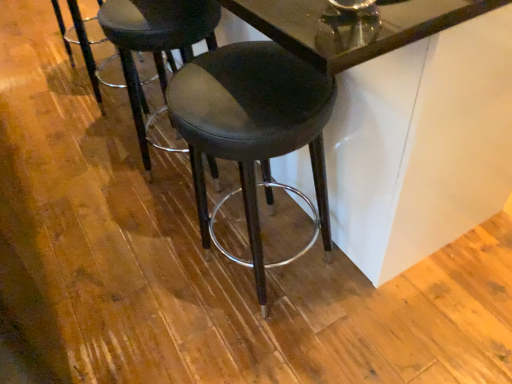
Question: Is glossy glass table at center closer to the viewer compared to black leather stool at center?

Choices:
 (A) no
 (B) yes

Answer: (B)

Question: Can you confirm if glossy glass table at center is bigger than black leather stool at center?

Choices:
 (A) yes
 (B) no

Answer: (A)

Question: Is glossy glass table at center smaller than black leather stool at center?

Choices:
 (A) yes
 (B) no

Answer: (B)

Question: From the image's perspective, does glossy glass table at center appear lower than black leather stool at center?

Choices:
 (A) yes
 (B) no

Answer: (B)

Question: Does glossy glass table at center have a greater height compared to black leather stool at center?

Choices:
 (A) no
 (B) yes

Answer: (B)

Question: From a real-world perspective, relative to glossy glass table at center, is matte black stool at center, which is counted as the 1th stool, starting from the left, vertically above or below?

Choices:
 (A) above
 (B) below

Answer: (B)

Question: From the image's perspective, is matte black stool at center, the second stool when ordered from right to left, above or below glossy glass table at center?

Choices:
 (A) above
 (B) below

Answer: (B)

Question: In the image, is matte black stool at center, which is counted as the 1th stool, starting from the left, on the left side or the right side of glossy glass table at center?

Choices:
 (A) left
 (B) right

Answer: (A)

Question: In terms of height, does matte black stool at center, the second stool when ordered from right to left, look taller or shorter compared to glossy glass table at center?

Choices:
 (A) short
 (B) tall

Answer: (A)

Question: In the image, is matte black stool at center, the second stool when ordered from right to left, on the left side or the right side of black leather stool at center?

Choices:
 (A) left
 (B) right

Answer: (B)

Question: Based on their sizes in the image, would you say matte black stool at center, which is counted as the 1th stool, starting from the left, is bigger or smaller than black leather stool at center?

Choices:
 (A) small
 (B) big

Answer: (B)

Question: Considering their positions, is matte black stool at center, the second stool when ordered from right to left, located in front of or behind black leather stool at center?

Choices:
 (A) behind
 (B) front

Answer: (B)

Question: Is point (185, 29) positioned closer to the camera than point (106, 84)?

Choices:
 (A) farther
 (B) closer

Answer: (B)

Question: In terms of size, does matte black stool at center, the second stool when ordered from right to left, appear bigger or smaller than black leather stool at center, the 1th stool from the right?

Choices:
 (A) big
 (B) small

Answer: (B)

Question: Considering the positions of point (128, 0) and point (270, 79), is point (128, 0) closer or farther from the camera than point (270, 79)?

Choices:
 (A) closer
 (B) farther

Answer: (B)